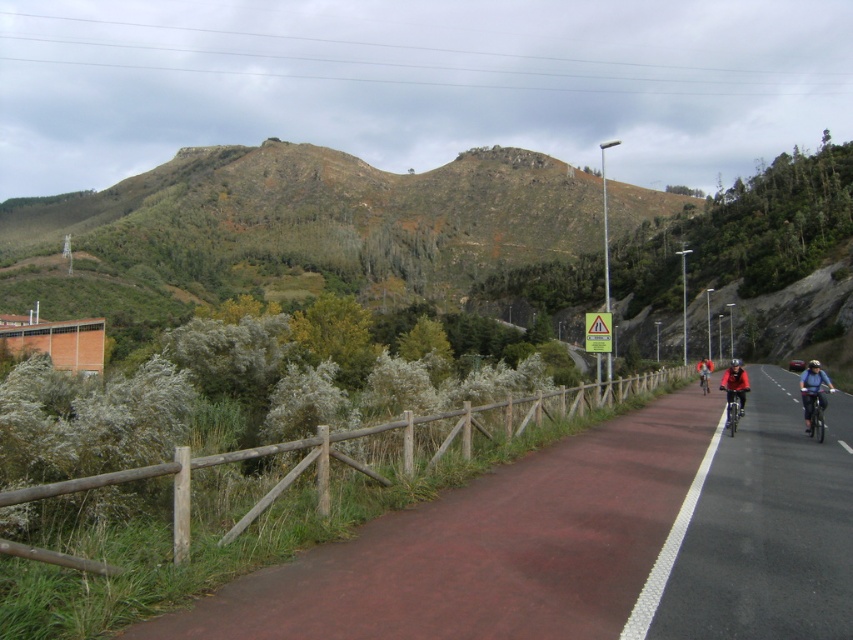
Question: Does red rubber bike path at center appear on the right side of red matte jacket at center?

Choices:
 (A) no
 (B) yes

Answer: (A)

Question: Which point is closer to the camera?

Choices:
 (A) (813, 396)
 (B) (724, 385)
 (C) (728, 412)
 (D) (407, 445)

Answer: (D)

Question: Does light blue fabric jacket at center-right have a lesser width compared to red matte jacket at center?

Choices:
 (A) yes
 (B) no

Answer: (A)

Question: Among these objects, which one is nearest to the camera?

Choices:
 (A) light blue fabric jacket at center-right
 (B) red jacket at center
 (C) red matte jacket at center

Answer: (A)

Question: Is shiny metallic bicycle at center-right wider than red jacket at center?

Choices:
 (A) yes
 (B) no

Answer: (B)

Question: Which point appears farthest from the camera in this image?

Choices:
 (A) (733, 401)
 (B) (706, 392)

Answer: (B)